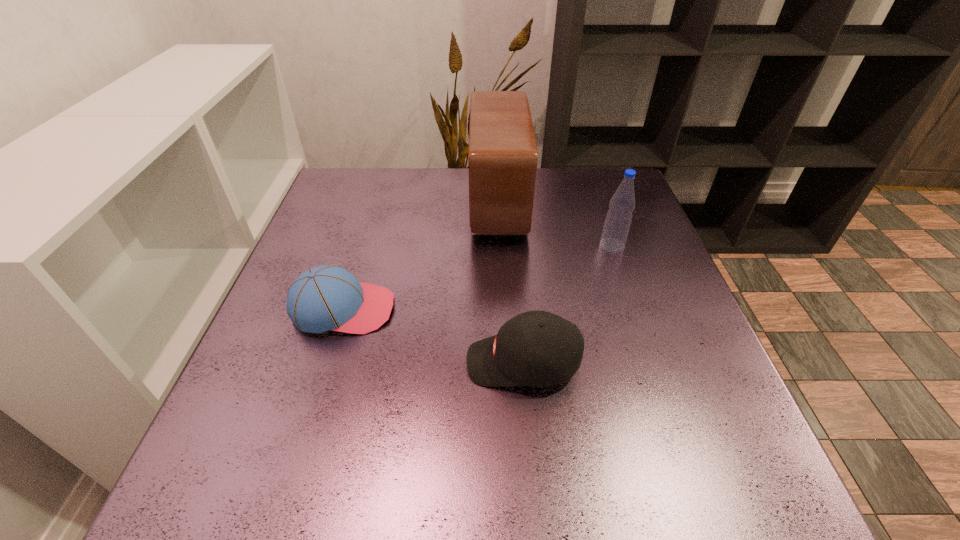
In the image, there is a desktop. Identify the location of vacant space at the near left corner. The image size is (960, 540). (226, 504).

In the image, there is a desktop. Identify the location of vacant space at the far right corner. This screenshot has width=960, height=540. (590, 198).

Where is `empty space that is in between the tallest object and the rightmost object`? Image resolution: width=960 pixels, height=540 pixels. empty space that is in between the tallest object and the rightmost object is located at coordinates (555, 224).

Locate an element on the screen. vacant space that's between the rightmost object and the right baseball cap is located at coordinates (567, 304).

In order to click on free point between the radio receiver and the right baseball cap in this screenshot , I will do `click(511, 282)`.

Locate an element on the screen. unoccupied area between the leftmost object and the right baseball cap is located at coordinates (433, 335).

This screenshot has width=960, height=540. What are the coordinates of `free point between the radio receiver and the third shortest object` in the screenshot? It's located at (555, 224).

Image resolution: width=960 pixels, height=540 pixels. I want to click on unoccupied position between the rightmost object and the tallest object, so click(x=555, y=224).

Find the location of `free area in between the third shortest object and the leftmost object`. free area in between the third shortest object and the leftmost object is located at coordinates (478, 277).

At what (x,y) coordinates should I click in order to perform the action: click on free point between the water bottle and the tallest object. Please return your answer as a coordinate pair (x, y). Image resolution: width=960 pixels, height=540 pixels. Looking at the image, I should click on [x=555, y=224].